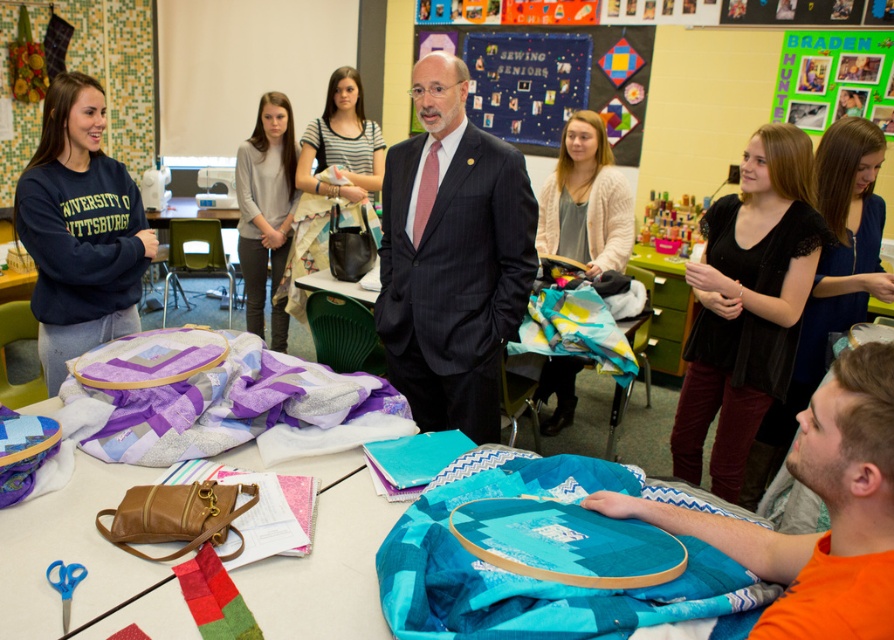
You are standing in the classroom and want to reach both the point at coordinates point (713, 570) and the point at coordinates point (758, 572). Which point will you reach first?

You will reach point (713, 570) first because it is closer to you than point (758, 572).

You are standing at the entrance of the classroom and want to locate the teal fabric at lower right. According to the coordinates provided, what are the exact coordinates where you should look to find it?

The teal fabric at lower right is located at coordinates point [538,579].

You are a student in the classroom and need to access both the teal fabric at lower right and the navy fleece sweatshirt at left. Which object is closer to you when you are standing at the table?

The teal fabric at lower right is closer to you since it is in front of the navy fleece sweatshirt at left.